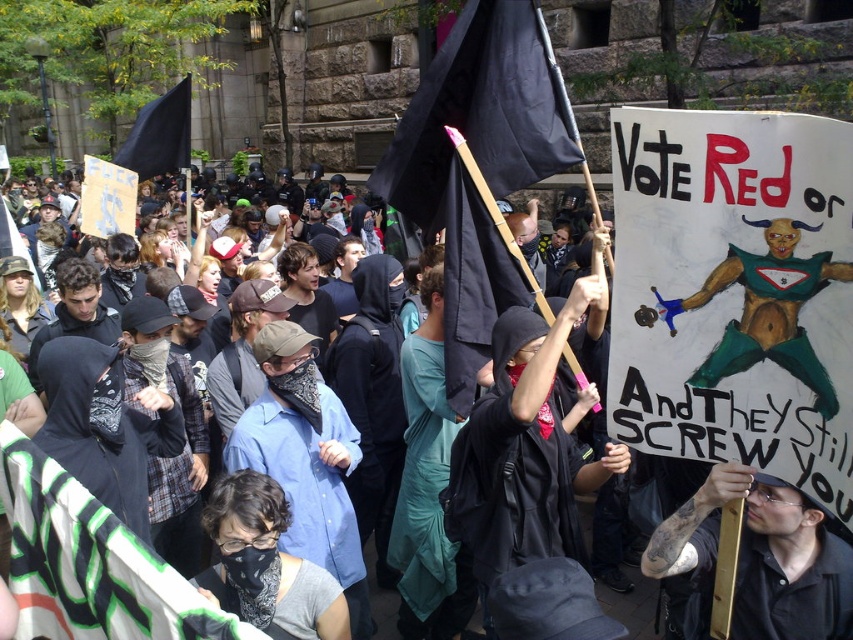
Question: Which object is closer to the camera taking this photo?

Choices:
 (A) black leather jacket at center
 (B) black fabric flag at upper left

Answer: (A)

Question: Among these objects, which one is nearest to the camera?

Choices:
 (A) black fabric flag at upper left
 (B) black leather jacket at center

Answer: (B)

Question: Is black leather jacket at center to the right of black fabric flag at upper left from the viewer's perspective?

Choices:
 (A) no
 (B) yes

Answer: (B)

Question: Which object appears farthest from the camera in this image?

Choices:
 (A) black leather jacket at center
 (B) black fabric flag at upper left

Answer: (B)

Question: Is black leather jacket at center bigger than black fabric flag at upper left?

Choices:
 (A) no
 (B) yes

Answer: (A)

Question: Where is black leather jacket at center located in relation to black fabric flag at upper left in the image?

Choices:
 (A) right
 (B) left

Answer: (A)